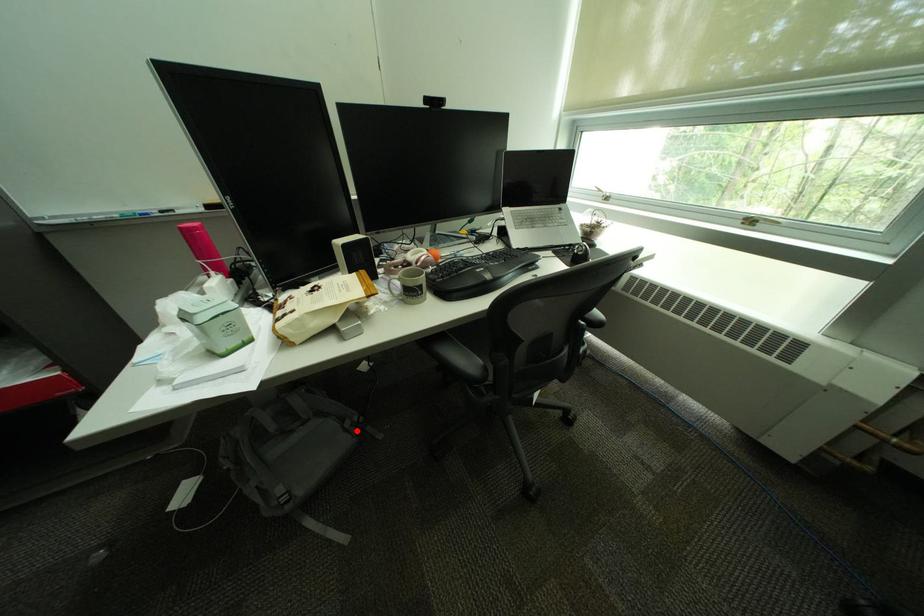
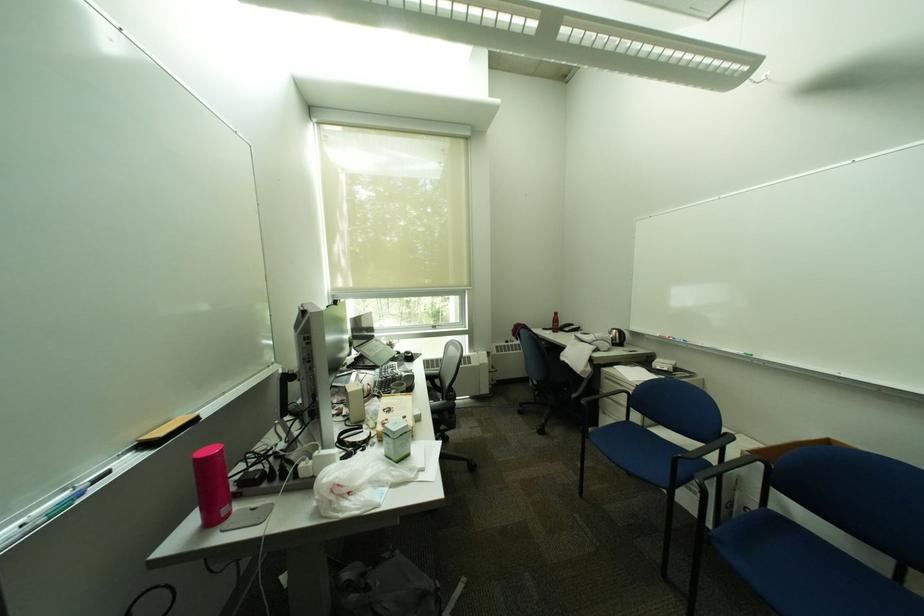
Locate, in the second image, the point that corresponds to the highlighted location in the first image.

(400, 560)